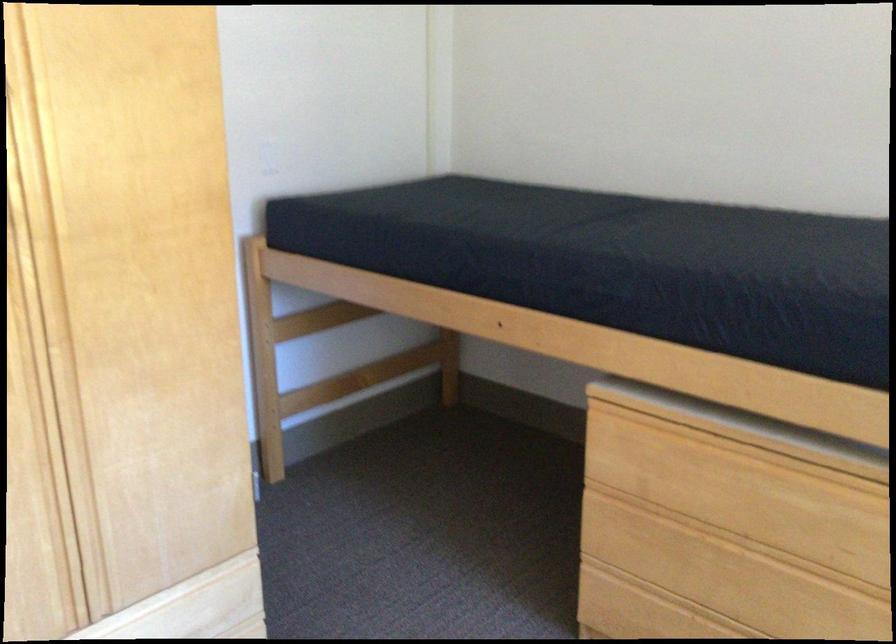
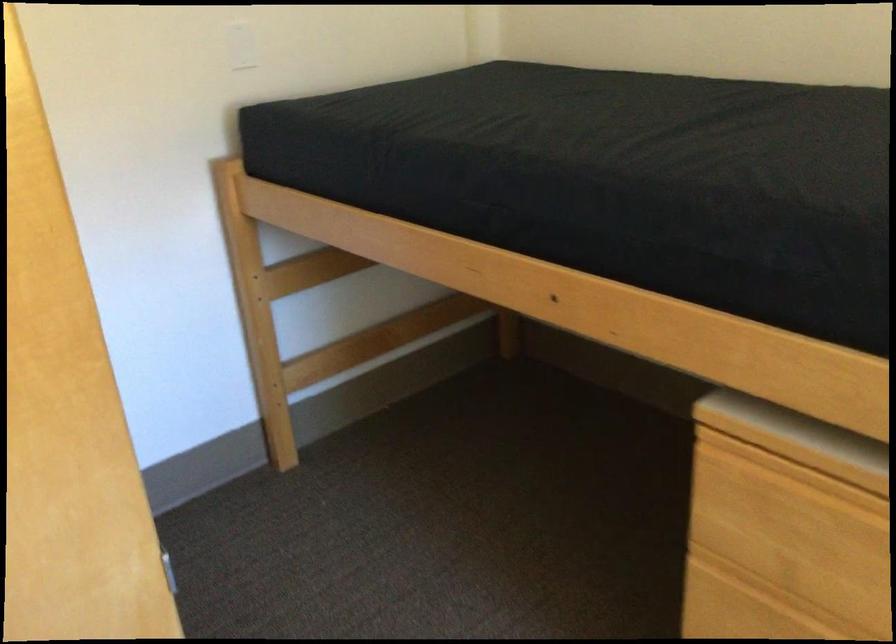
Question: I am providing you with two images of the same scene from different viewpoints. Please identify which objects are invisible in image2.

Choices:
 (A) drawer handle lip
 (B) bed ladder rung
 (C) light switch
 (D) none of these

Answer: (D)